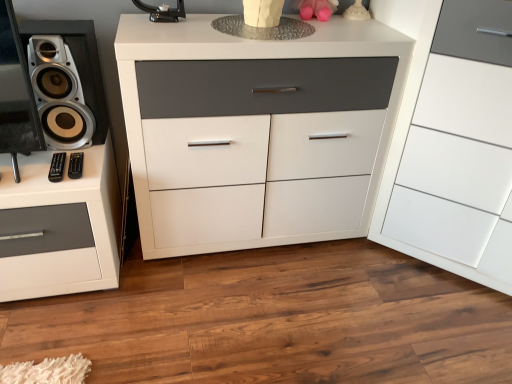
The width and height of the screenshot is (512, 384). What do you see at coordinates (57, 167) in the screenshot?
I see `black plastic remote at lower left` at bounding box center [57, 167].

Locate an element on the screen. Image resolution: width=512 pixels, height=384 pixels. black plastic remote at lower left is located at coordinates (57, 167).

The image size is (512, 384). What do you see at coordinates (316, 9) in the screenshot? I see `pink rubber toy at upper center` at bounding box center [316, 9].

The image size is (512, 384). Find the location of `white glossy drawer at center, the first chest of drawers when ordered from right to left`. white glossy drawer at center, the first chest of drawers when ordered from right to left is located at coordinates (453, 152).

Is pink rubber toy at upper center looking in the opposite direction of white matte chest of drawers at center, placed as the second chest of drawers when sorted from right to left?

pink rubber toy at upper center is not turned away from white matte chest of drawers at center, placed as the second chest of drawers when sorted from right to left.

Can you tell me how much pink rubber toy at upper center and white matte chest of drawers at center, which is the first chest of drawers from left to right, differ in facing direction?

There is a 8.46-degree angle between the facing directions of pink rubber toy at upper center and white matte chest of drawers at center, which is the first chest of drawers from left to right.

Is there a large distance between pink rubber toy at upper center and white matte chest of drawers at center, which is the first chest of drawers from left to right?

No, pink rubber toy at upper center is not far away from white matte chest of drawers at center, which is the first chest of drawers from left to right.

Is pink rubber toy at upper center facing away from white glossy speaker at left?

pink rubber toy at upper center does not have its back to white glossy speaker at left.

How much distance is there between pink rubber toy at upper center and white glossy speaker at left?

A distance of 87.92 centimeters exists between pink rubber toy at upper center and white glossy speaker at left.

Considering the positions of objects pink rubber toy at upper center and white glossy speaker at left in the image provided, who is more to the right, pink rubber toy at upper center or white glossy speaker at left?

From the viewer's perspective, pink rubber toy at upper center appears more on the right side.

Is pink rubber toy at upper center wider than white glossy speaker at left?

No, pink rubber toy at upper center is not wider than white glossy speaker at left.

Do you think white glossy drawer at center, the first chest of drawers when ordered from right to left, is within black plastic remote at lower left, or outside of it?

white glossy drawer at center, the first chest of drawers when ordered from right to left, is not enclosed by black plastic remote at lower left.

Between white glossy drawer at center, the first chest of drawers when ordered from right to left, and black plastic remote at lower left, which one has larger width?

white glossy drawer at center, the first chest of drawers when ordered from right to left.

Is white glossy drawer at center, the first chest of drawers when ordered from right to left, looking in the opposite direction of black plastic remote at lower left?

No, black plastic remote at lower left is not at the back of white glossy drawer at center, the first chest of drawers when ordered from right to left.

Can you tell me how much white glossy drawer at center, which appears as the 2th chest of drawers when viewed from the left, and black plastic remote at lower left differ in facing direction?

The angle between the facing direction of white glossy drawer at center, which appears as the 2th chest of drawers when viewed from the left, and the facing direction of black plastic remote at lower left is 0.11 degrees.

Looking at this image, how much distance is there between white matte chest of drawers at center, which is the first chest of drawers from left to right, and white glossy speaker at left?

white matte chest of drawers at center, which is the first chest of drawers from left to right, and white glossy speaker at left are 21.06 inches apart.

In terms of width, does white matte chest of drawers at center, placed as the second chest of drawers when sorted from right to left, look wider or thinner when compared to white glossy speaker at left?

In the image, white matte chest of drawers at center, placed as the second chest of drawers when sorted from right to left, appears to be wider than white glossy speaker at left.

Who is bigger, white matte chest of drawers at center, which is the first chest of drawers from left to right, or white glossy speaker at left?

white matte chest of drawers at center, which is the first chest of drawers from left to right.

Consider the image. Does white matte chest of drawers at center, which is the first chest of drawers from left to right, touch white glossy speaker at left?

No, white matte chest of drawers at center, which is the first chest of drawers from left to right, is not beside white glossy speaker at left.

Is black plastic remote at lower left beside pink rubber toy at upper center?

No, black plastic remote at lower left is not touching pink rubber toy at upper center.

In the scene shown: Is pink rubber toy at upper center a part of black plastic remote at lower left?

No, black plastic remote at lower left does not contain pink rubber toy at upper center.

Which is in front, point (54, 169) or point (326, 9)?

The point (54, 169) is in front.

Is black plastic remote at lower left taller than pink rubber toy at upper center?

In fact, black plastic remote at lower left may be shorter than pink rubber toy at upper center.

Considering the points (197, 207) and (328, 1), which point is behind, point (197, 207) or point (328, 1)?

The point (197, 207) is farther from the camera.

Is white matte chest of drawers at center, placed as the second chest of drawers when sorted from right to left, taller or shorter than pink rubber toy at upper center?

Considering their sizes, white matte chest of drawers at center, placed as the second chest of drawers when sorted from right to left, has more height than pink rubber toy at upper center.

From a real-world perspective, which object stands above the other?

pink rubber toy at upper center.

Consider the image. From the image's perspective, is white matte chest of drawers at center, placed as the second chest of drawers when sorted from right to left, above or below pink rubber toy at upper center?

Based on their image positions, white matte chest of drawers at center, placed as the second chest of drawers when sorted from right to left, is located beneath pink rubber toy at upper center.

Between pink rubber toy at upper center and white glossy drawer at center, which appears as the 2th chest of drawers when viewed from the left, which one is positioned in front?

white glossy drawer at center, which appears as the 2th chest of drawers when viewed from the left, is in front.

Are pink rubber toy at upper center and white glossy drawer at center, the first chest of drawers when ordered from right to left, far apart?

Result: They are positioned close to each other.

From a real-world perspective, is pink rubber toy at upper center physically above white glossy drawer at center, the first chest of drawers when ordered from right to left?

Yes.

Where is `toy above the white glossy drawer at center, the first chest of drawers when ordered from right to left (from a real-world perspective)`? The image size is (512, 384). toy above the white glossy drawer at center, the first chest of drawers when ordered from right to left (from a real-world perspective) is located at coordinates (316, 9).

This screenshot has width=512, height=384. I want to click on the chest of drawers that is the 1st one when counting forward from the pink rubber toy at upper center, so coord(255,131).

Image resolution: width=512 pixels, height=384 pixels. I want to click on toy above the white glossy speaker at left (from the image's perspective), so click(x=316, y=9).

From the image, which object appears to be nearer to white matte chest of drawers at center, placed as the second chest of drawers when sorted from right to left, pink rubber toy at upper center or black plastic remote at lower left?

Based on the image, pink rubber toy at upper center appears to be nearer to white matte chest of drawers at center, placed as the second chest of drawers when sorted from right to left.

Considering their positions, is white matte chest of drawers at center, which is the first chest of drawers from left to right, positioned closer to white glossy speaker at left than white glossy drawer at center, which appears as the 2th chest of drawers when viewed from the left?

white matte chest of drawers at center, which is the first chest of drawers from left to right, is positioned closer to the anchor white glossy speaker at left.

Estimate the real-world distances between objects in this image. Which object is further from white glossy drawer at center, which appears as the 2th chest of drawers when viewed from the left, white glossy speaker at left or white matte chest of drawers at center, which is the first chest of drawers from left to right?

white glossy speaker at left is further to white glossy drawer at center, which appears as the 2th chest of drawers when viewed from the left.

Based on the photo, estimate the real-world distances between objects in this image. Which object is closer to black plastic remote at lower left, pink rubber toy at upper center or white matte chest of drawers at center, which is the first chest of drawers from left to right?

white matte chest of drawers at center, which is the first chest of drawers from left to right, is positioned closer to the anchor black plastic remote at lower left.

Which object lies nearer to the anchor point pink rubber toy at upper center, black plastic remote at lower left or white matte chest of drawers at center, placed as the second chest of drawers when sorted from right to left?

white matte chest of drawers at center, placed as the second chest of drawers when sorted from right to left.

Based on their spatial positions, is white glossy drawer at center, the first chest of drawers when ordered from right to left, or white matte chest of drawers at center, placed as the second chest of drawers when sorted from right to left, further from pink rubber toy at upper center?

white glossy drawer at center, the first chest of drawers when ordered from right to left.

Estimate the real-world distances between objects in this image. Which object is further from white matte chest of drawers at center, which is the first chest of drawers from left to right, white glossy drawer at center, which appears as the 2th chest of drawers when viewed from the left, or white glossy speaker at left?

The object further to white matte chest of drawers at center, which is the first chest of drawers from left to right, is white glossy speaker at left.

Estimate the real-world distances between objects in this image. Which object is further from white glossy speaker at left, white glossy drawer at center, the first chest of drawers when ordered from right to left, or white matte chest of drawers at center, placed as the second chest of drawers when sorted from right to left?

Based on the image, white glossy drawer at center, the first chest of drawers when ordered from right to left, appears to be further to white glossy speaker at left.

You are a GUI agent. You are given a task and a screenshot of the screen. Output one action in this format:
    pyautogui.click(x=<x>, y=<y>)
    Task: Click on the chest of drawers located between black plastic remote at lower left and white glossy drawer at center, the first chest of drawers when ordered from right to left, in the left-right direction
    The width and height of the screenshot is (512, 384).
    Given the screenshot: What is the action you would take?
    pyautogui.click(x=255, y=131)

At what (x,y) coordinates should I click in order to perform the action: click on chest of drawers between black plastic remote at lower left and pink rubber toy at upper center. Please return your answer as a coordinate pair (x, y). The height and width of the screenshot is (384, 512). Looking at the image, I should click on (255, 131).

At what (x,y) coordinates should I click in order to perform the action: click on toy between black plastic remote at lower left and white glossy drawer at center, which appears as the 2th chest of drawers when viewed from the left. Please return your answer as a coordinate pair (x, y). The height and width of the screenshot is (384, 512). Looking at the image, I should click on (316, 9).

Identify the location of control situated between white glossy speaker at left and pink rubber toy at upper center from left to right. This screenshot has height=384, width=512. (57, 167).